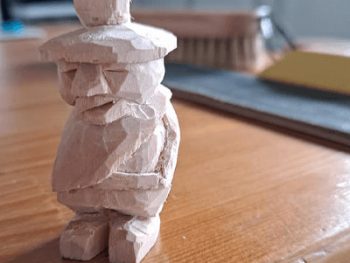
I want to click on statuette, so click(123, 177), click(103, 102), click(103, 85), click(145, 203), click(103, 30), click(88, 232).